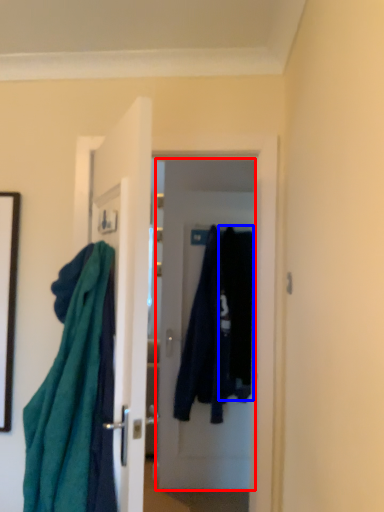
Question: Which point is further to the camera, door (highlighted by a red box) or clothing (highlighted by a blue box)?

Choices:
 (A) door
 (B) clothing

Answer: (A)